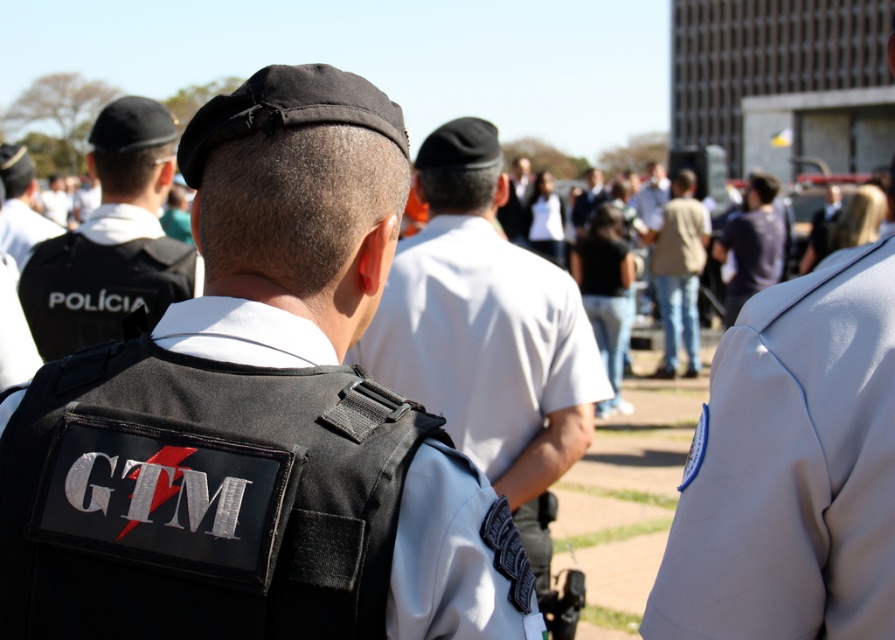
Consider the image. You are a member of the crowd observing the police officers. From your perspective, which point is closer to you, point [697,253] or point [729,301]?

Point [729,301] is closer to you because point [697,253] is behind it.

You are a photographer at the event and want to capture a photo of the denim jeans at center and dark blue shirt at center. Which clothing item is located lower in the image?

The denim jeans at center is positioned under the dark blue shirt at center, so the denim jeans at center is located lower in the image.